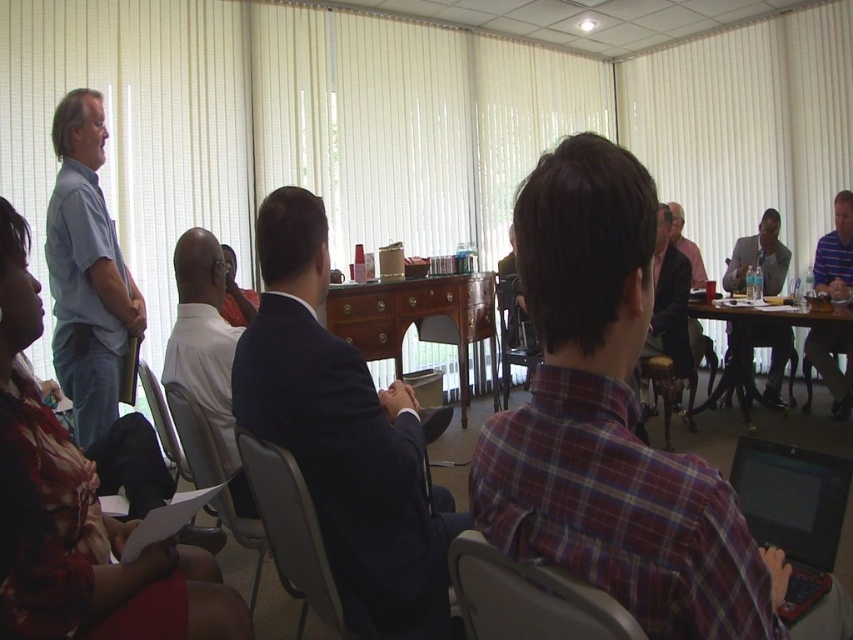
You are an attendee in the conference room. You see a point marked at coordinates (670, 304). Which object is this point located on?

The point marked at coordinates (670, 304) is located on the pink fabric shirt at center.